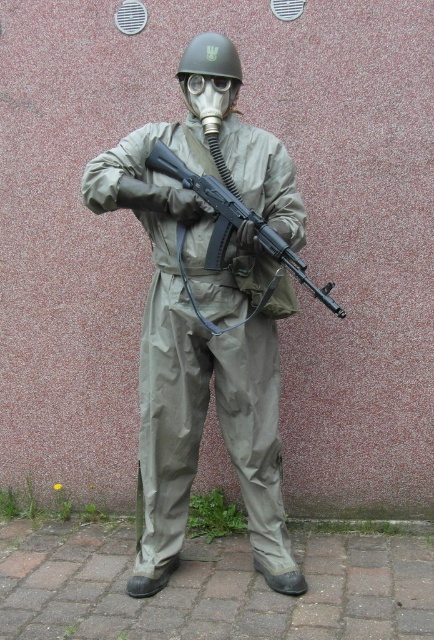
Question: Does matte black helmet at center have a greater width compared to transparent plastic goggles at center?

Choices:
 (A) no
 (B) yes

Answer: (B)

Question: Is matte black rifle at center in front of matte black helmet at center?

Choices:
 (A) no
 (B) yes

Answer: (B)

Question: Estimate the real-world distances between objects in this image. Which object is farther from the matte khaki uniform at center?

Choices:
 (A) transparent plastic goggles at center
 (B) matte black helmet at center
 (C) matte black rifle at center

Answer: (A)

Question: Which of these objects is positioned closest to the matte black helmet at center?

Choices:
 (A) matte khaki uniform at center
 (B) matte black rifle at center

Answer: (B)

Question: Based on their relative distances, which object is farther from the transparent plastic goggles at center?

Choices:
 (A) matte khaki uniform at center
 (B) matte black helmet at center
 (C) matte black rifle at center

Answer: (A)

Question: Can you confirm if matte khaki uniform at center is smaller than matte black rifle at center?

Choices:
 (A) no
 (B) yes

Answer: (A)